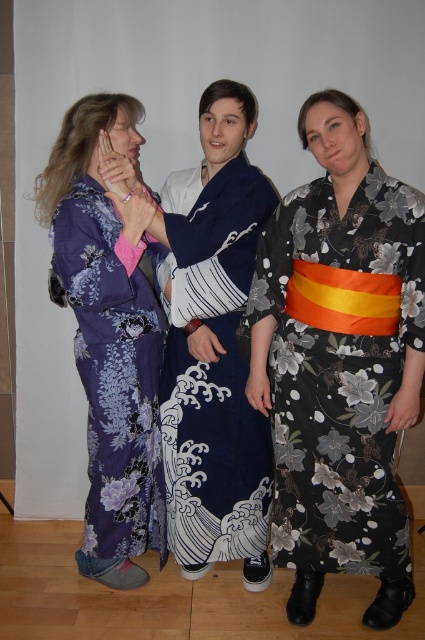
You are designing a traditional Japanese stage where the purple floral kimono at left and the navy blue silk kimono at center will be displayed side by side. Given their sizes, which kimono requires more space horizontally for proper display?

The purple floral kimono at left requires more horizontal space because its width is larger than the navy blue silk kimono at center.

You are a photographer setting up a shoot for a kimono fashion catalog. You need to arrange the models so that the larger kimono is positioned where it can be the focal point. Given the current setup, where should the black floral kimono at right be placed relative to the navy blue silk kimono at center to achieve this?

The black floral kimono at right is larger in size than the navy blue silk kimono at center, so to make it the focal point, it should be placed in a central position where it can be highlighted, moving the navy blue silk kimono at center to the side.